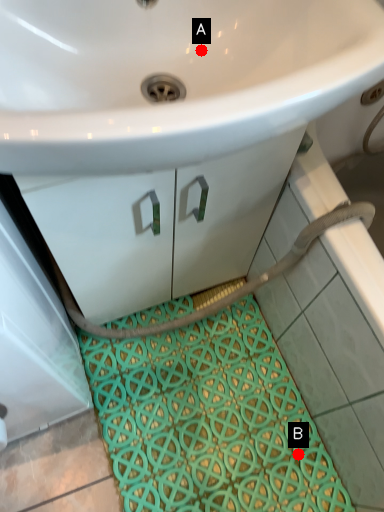
Question: Two points are circled on the image, labeled by A and B beside each circle. Which point is farther to the camera?

Choices:
 (A) A is further
 (B) B is further

Answer: (B)